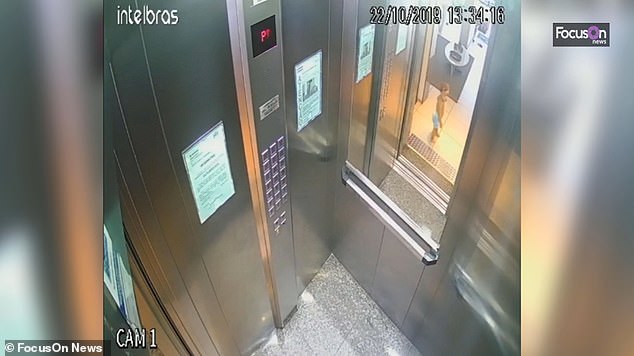
This screenshot has height=356, width=634. In order to click on elevator buttons in this screenshot , I will do `click(280, 171)`, `click(278, 191)`, `click(269, 157)`, `click(278, 153)`.